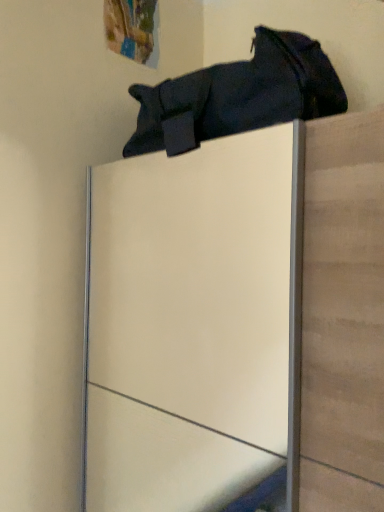
Question: Considering the relative positions of dark fabric bag at upper center and white glossy cabinet at upper center in the image provided, is dark fabric bag at upper center to the left or to the right of white glossy cabinet at upper center?

Choices:
 (A) left
 (B) right

Answer: (A)

Question: Is dark fabric bag at upper center situated inside white glossy cabinet at upper center or outside?

Choices:
 (A) outside
 (B) inside

Answer: (A)

Question: Is dark fabric bag at upper center in front of or behind white glossy cabinet at upper center in the image?

Choices:
 (A) front
 (B) behind

Answer: (B)

Question: Looking at the image, does white glossy cabinet at upper center seem bigger or smaller compared to dark fabric bag at upper center?

Choices:
 (A) big
 (B) small

Answer: (A)

Question: Is point (279, 157) positioned closer to the camera than point (230, 75)?

Choices:
 (A) closer
 (B) farther

Answer: (B)

Question: Is white glossy cabinet at upper center in front of or behind dark fabric bag at upper center in the image?

Choices:
 (A) front
 (B) behind

Answer: (A)

Question: In the image, is white glossy cabinet at upper center on the left side or the right side of dark fabric bag at upper center?

Choices:
 (A) left
 (B) right

Answer: (B)